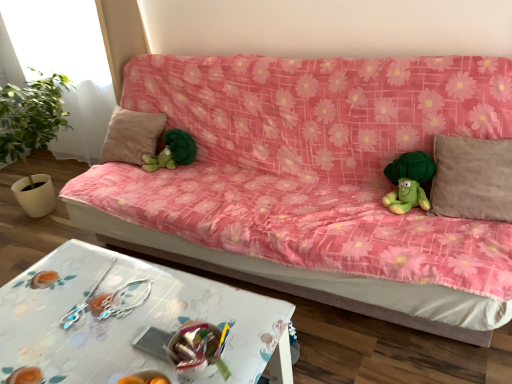
The width and height of the screenshot is (512, 384). Identify the location of free space in front of silver metallic earrings at lower center. (70, 341).